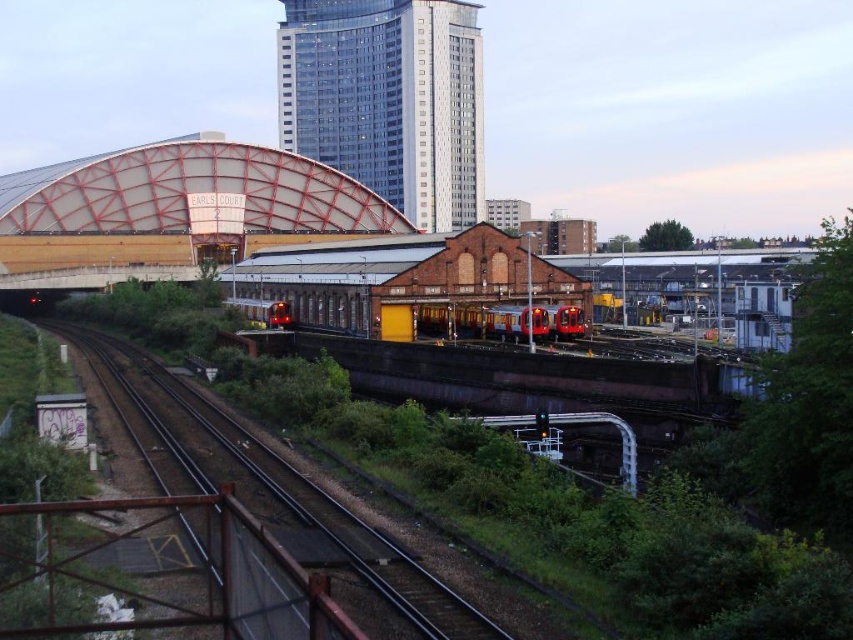
Based on the photo, you are a drone operator tasked with delivering a package to a location near the smooth metal train track at center. Your drone has a maximum flight range of 200 meters. Based on the scene, can your drone reach the delivery location from the glassy metallic skyscraper at upper center without exceeding its range?

The glassy metallic skyscraper at upper center is 224.65 meters away from the smooth metal train track at center. Since the drone has a maximum flight range of 200 meters, it cannot reach the delivery location from the glassy metallic skyscraper at upper center without exceeding its range.

You are standing at the edge of the railway tracks looking towards the red brick building. There are two points marked on the ground in front of you. One is at coordinate point [300,481] and the other is at point [561,337]. Which point is closer to you?

Point [300,481] is closer to the viewer than point [561,337].

You are a photographer standing at the edge of the railway tracks. You want to capture a photo that includes both the glassy metallic skyscraper at upper center and the red metallic train at center. Based on their positions, which object should you focus on first if you want to ensure both are in the frame?

The glassy metallic skyscraper at upper center is above the red metallic train at center, so you should focus on the red metallic train at center first to ensure both are in the frame.